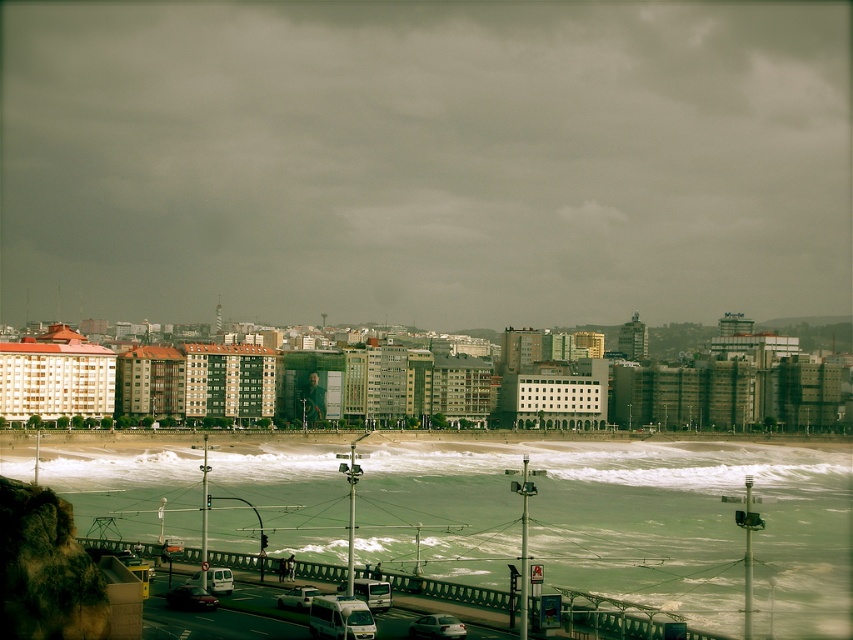
Question: Estimate the real-world distances between objects in this image. Which object is closer to the dark gray clouds at upper center?

Choices:
 (A) matte silver car at center
 (B) white matte van at lower center

Answer: (B)

Question: Does white matte van at lower center have a lesser width compared to silver metallic van at center?

Choices:
 (A) yes
 (B) no

Answer: (B)

Question: Which object is positioned closest to the dark gray clouds at upper center?

Choices:
 (A) greenish water at lower center
 (B) white matte van at lower center
 (C) matte silver van at lower center

Answer: (A)

Question: Is matte silver van at lower center positioned in front of white matte van at lower center?

Choices:
 (A) no
 (B) yes

Answer: (B)

Question: Is shiny silver car at lower left behind silver metallic van at center?

Choices:
 (A) yes
 (B) no

Answer: (B)

Question: Which point is farther to the camera?

Choices:
 (A) (178, 589)
 (B) (712, 176)

Answer: (B)